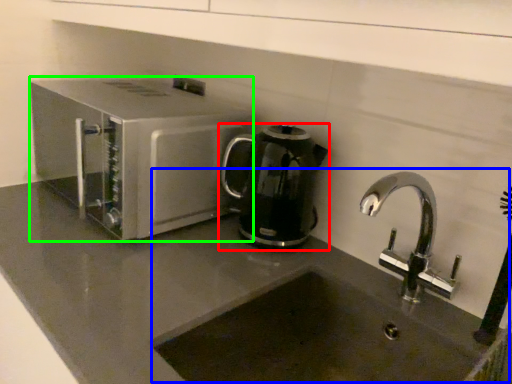
Question: Considering the real-world distances, which object is farthest from kitchen appliance (highlighted by a red box)? sink (highlighted by a blue box) or home appliance (highlighted by a green box)?

Choices:
 (A) sink
 (B) home appliance

Answer: (B)